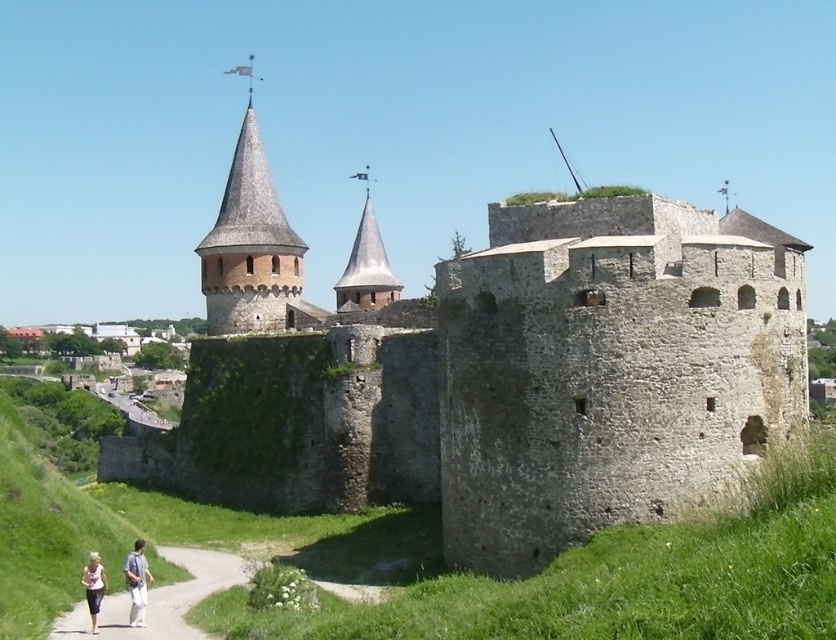
You are a tour guide explaining the fortress layout to visitors. You mention the stone wall at center and the gravel path at lower left. Which one is wider?

The stone wall at center is wider than the gravel path at lower left.

You are a tourist visiting the fortress and want to take a photo of the gravel path at lower left and the light pink fabric at lower left. Which object should you position to the right side of your camera frame to capture both?

To capture both the gravel path at lower left and the light pink fabric at lower left in your photo, you should position the gravel path at lower left to the right side of your camera frame since it is located to the right of the light pink fabric at lower left.